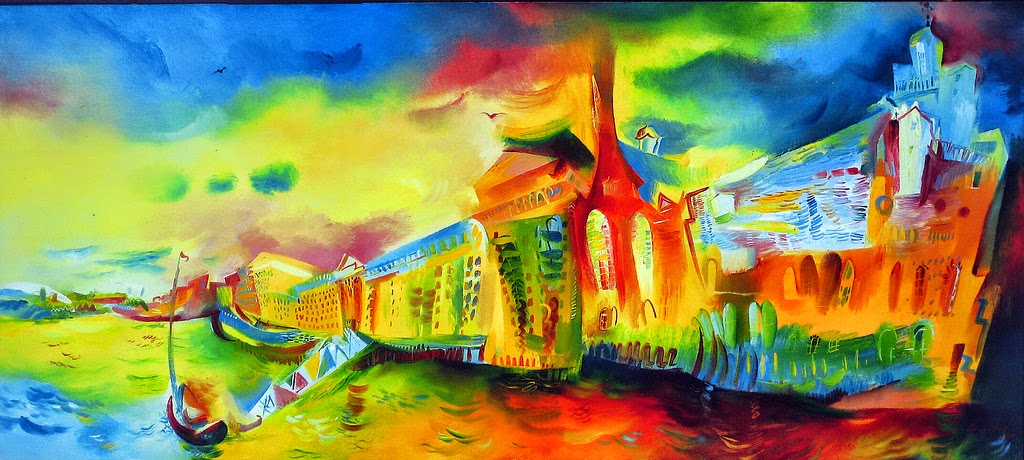
Locate an element on the screen. The image size is (1024, 460). abstract sea painting is located at coordinates (489, 161).